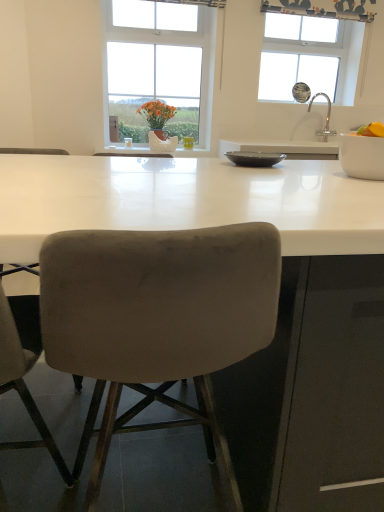
This screenshot has height=512, width=384. What do you see at coordinates (158, 318) in the screenshot?
I see `velvet beige chair at center, which ranks as the 1th chair in right-to-left order` at bounding box center [158, 318].

Identify the location of white ceramic vase at center. 162,143.

Where is `velvet beige chair at lower left, the second chair positioned from the right`? This screenshot has width=384, height=512. velvet beige chair at lower left, the second chair positioned from the right is located at coordinates (25, 368).

Where is `transparent glass window at upper right, marked as the first window in a right-to-left arrangement`? This screenshot has width=384, height=512. transparent glass window at upper right, marked as the first window in a right-to-left arrangement is located at coordinates (317, 42).

What do you see at coordinates (255, 158) in the screenshot? I see `matte black bowl at center, which is the 2th bowl in front-to-back order` at bounding box center [255, 158].

You are a GUI agent. You are given a task and a screenshot of the screen. Output one action in this format:
    pyautogui.click(x=<x>, y=<y>)
    Task: Click on the velvet beige chair at center, which ranks as the 1th chair in right-to-left order
    
    Given the screenshot: What is the action you would take?
    pyautogui.click(x=158, y=318)

Does white glossy bowl at right, the 2th bowl from the back, come in front of transparent glass window at upper right, marked as the first window in a right-to-left arrangement?

Yes, it is in front of transparent glass window at upper right, marked as the first window in a right-to-left arrangement.

Based on the photo, from the image's perspective, is white glossy bowl at right, the first bowl when ordered from front to back, beneath transparent glass window at upper right, marked as the first window in a right-to-left arrangement?

Yes, from the image's perspective, white glossy bowl at right, the first bowl when ordered from front to back, is below transparent glass window at upper right, marked as the first window in a right-to-left arrangement.

From a real-world perspective, is white glossy bowl at right, the 2th bowl from the back, positioned under transparent glass window at upper right, marked as the first window in a right-to-left arrangement, based on gravity?

Yes.

From a real-world perspective, is silver metallic faucet at upper right on top of velvet beige chair at lower left, which ranks as the first chair in left-to-right order?

Yes.

Who is shorter, silver metallic faucet at upper right or velvet beige chair at lower left, the second chair positioned from the right?

silver metallic faucet at upper right is shorter.

Is silver metallic faucet at upper right not close to velvet beige chair at lower left, the second chair positioned from the right?

Indeed, silver metallic faucet at upper right is not near velvet beige chair at lower left, the second chair positioned from the right.

Could you measure the distance between silver metallic faucet at upper right and velvet beige chair at lower left, the second chair positioned from the right?

The distance of silver metallic faucet at upper right from velvet beige chair at lower left, the second chair positioned from the right, is 3.24 meters.

Is white ceramic vase at center further to the viewer compared to silver metallic faucet at upper right?

No, it is not.

I want to click on vase below the silver metallic faucet at upper right (from the image's perspective), so click(162, 143).

Based on their sizes in the image, would you say white ceramic vase at center is bigger or smaller than silver metallic faucet at upper right?

Considering their sizes, white ceramic vase at center takes up less space than silver metallic faucet at upper right.

Which is in front, point (164, 148) or point (256, 153)?

Positioned in front is point (256, 153).

Considering the relative sizes of white ceramic vase at center and matte black bowl at center, which is the 2th bowl in front-to-back order, in the image provided, is white ceramic vase at center shorter than matte black bowl at center, which is the 2th bowl in front-to-back order,?

Incorrect, the height of white ceramic vase at center does not fall short of that of matte black bowl at center, which is the 2th bowl in front-to-back order.

Is the surface of white ceramic vase at center in direct contact with matte black bowl at center, which is the 2th bowl in front-to-back order?

No, white ceramic vase at center is not in contact with matte black bowl at center, which is the 2th bowl in front-to-back order.

Identify the location of the 1st bowl in front of the white ceramic vase at center, starting your count from the anchor. (x=255, y=158).

Between white glossy window at upper center, positioned as the second window in right-to-left order, and silver metallic faucet at upper right, which one has more height?

white glossy window at upper center, positioned as the second window in right-to-left order, is taller.

Does point (112, 78) lie behind point (308, 111)?

No, (112, 78) is in front of (308, 111).

Which is correct: white glossy window at upper center, positioned as the second window in right-to-left order, is inside silver metallic faucet at upper right, or outside of it?

white glossy window at upper center, positioned as the second window in right-to-left order, exists outside the volume of silver metallic faucet at upper right.

From the picture: Is white glossy window at upper center, the first window in the left-to-right sequence, to the left of silver metallic faucet at upper right from the viewer's perspective?

Yes, white glossy window at upper center, the first window in the left-to-right sequence, is to the left of silver metallic faucet at upper right.

Which object is wider, orange matte at right or silver metallic faucet at upper right?

silver metallic faucet at upper right is wider.

Are orange matte at right and silver metallic faucet at upper right located far from each other?

Yes, orange matte at right is far from silver metallic faucet at upper right.

Is orange matte at right not within silver metallic faucet at upper right?

Yes, orange matte at right is outside of silver metallic faucet at upper right.

From the picture: Based on their sizes in the image, would you say orange matte at right is bigger or smaller than silver metallic faucet at upper right?

Clearly, orange matte at right is smaller in size than silver metallic faucet at upper right.

Would you say transparent glass window at upper right, marked as the first window in a right-to-left arrangement, is outside orange matte at right?

Yes, transparent glass window at upper right, marked as the first window in a right-to-left arrangement, is located beyond the bounds of orange matte at right.

You are a GUI agent. You are given a task and a screenshot of the screen. Output one action in this format:
    pyautogui.click(x=<x>, y=<y>)
    Task: Click on the orange beneath the transparent glass window at upper right, marked as the first window in a right-to-left arrangement (from a real-world perspective)
    
    Given the screenshot: What is the action you would take?
    pyautogui.click(x=372, y=130)

Is transparent glass window at upper right, marked as the second window in a left-to-right arrangement, aimed at orange matte at right?

Yes, transparent glass window at upper right, marked as the second window in a left-to-right arrangement, is turned towards orange matte at right.

From the picture: Which object is positioned more to the right, transparent glass window at upper right, marked as the second window in a left-to-right arrangement, or orange matte at right?

transparent glass window at upper right, marked as the second window in a left-to-right arrangement, is more to the right.

From a real-world perspective, starting from the white glossy bowl at right, the 2th bowl from the back, which window is the 2nd one vertically above it? Please provide its 2D coordinates.

[(317, 42)]

From the image's perspective, starting from the silver metallic faucet at upper right, which chair is the 2nd one below? Please provide its 2D coordinates.

[(25, 368)]

When comparing their distances from white glossy bowl at right, the 2th bowl from the back, does transparent glass window at upper right, marked as the first window in a right-to-left arrangement, or silver metallic faucet at upper right seem further?

transparent glass window at upper right, marked as the first window in a right-to-left arrangement.

From the image, which object appears to be farther from white glossy window at upper center, positioned as the second window in right-to-left order, silver metallic faucet at upper right or velvet beige chair at lower left, the second chair positioned from the right?

Among the two, velvet beige chair at lower left, the second chair positioned from the right, is located further to white glossy window at upper center, positioned as the second window in right-to-left order.

Looking at the image, which one is located closer to white glossy bowl at right, the 2th bowl from the back, transparent glass window at upper right, marked as the second window in a left-to-right arrangement, or velvet beige chair at lower left, which ranks as the first chair in left-to-right order?

velvet beige chair at lower left, which ranks as the first chair in left-to-right order, is closer to white glossy bowl at right, the 2th bowl from the back.

Estimate the real-world distances between objects in this image. Which object is closer to velvet beige chair at center, the second chair viewed from the left, transparent glass window at upper right, marked as the first window in a right-to-left arrangement, or white ceramic vase at center?

white ceramic vase at center.

Estimate the real-world distances between objects in this image. Which object is closer to white glossy bowl at right, the 1th bowl positioned from the right, matte black bowl at center, which is the 2th bowl in front-to-back order, or orange matte at right?

orange matte at right is closer to white glossy bowl at right, the 1th bowl positioned from the right.

Based on their spatial positions, is velvet beige chair at center, which ranks as the 1th chair in right-to-left order, or white ceramic vase at center closer to white glossy bowl at right, the first bowl when ordered from front to back?

velvet beige chair at center, which ranks as the 1th chair in right-to-left order, lies closer to white glossy bowl at right, the first bowl when ordered from front to back, than the other object.

Looking at the image, which one is located closer to silver metallic faucet at upper right, velvet beige chair at lower left, the second chair positioned from the right, or orange matte at right?

Based on the image, orange matte at right appears to be nearer to silver metallic faucet at upper right.

Based on the photo, which object lies nearer to the anchor point matte black bowl at center, which is the 2th bowl in front-to-back order, white ceramic vase at center or velvet beige chair at lower left, the second chair positioned from the right?

velvet beige chair at lower left, the second chair positioned from the right, is closer to matte black bowl at center, which is the 2th bowl in front-to-back order.

Where is `vase between white glossy window at upper center, the first window in the left-to-right sequence, and silver metallic faucet at upper right`? This screenshot has height=512, width=384. vase between white glossy window at upper center, the first window in the left-to-right sequence, and silver metallic faucet at upper right is located at coordinates (162, 143).

Where is `chair between velvet beige chair at lower left, the second chair positioned from the right, and silver metallic faucet at upper right from front to back`? chair between velvet beige chair at lower left, the second chair positioned from the right, and silver metallic faucet at upper right from front to back is located at coordinates (158, 318).

Locate an element on the screen. Image resolution: width=384 pixels, height=512 pixels. vase between white glossy bowl at right, the first bowl when ordered from front to back, and white glossy window at upper center, positioned as the second window in right-to-left order, along the z-axis is located at coordinates (162, 143).

Image resolution: width=384 pixels, height=512 pixels. Identify the location of orange between white glossy bowl at right, the 1th bowl positioned from the right, and silver metallic faucet at upper right, along the z-axis. (372, 130).